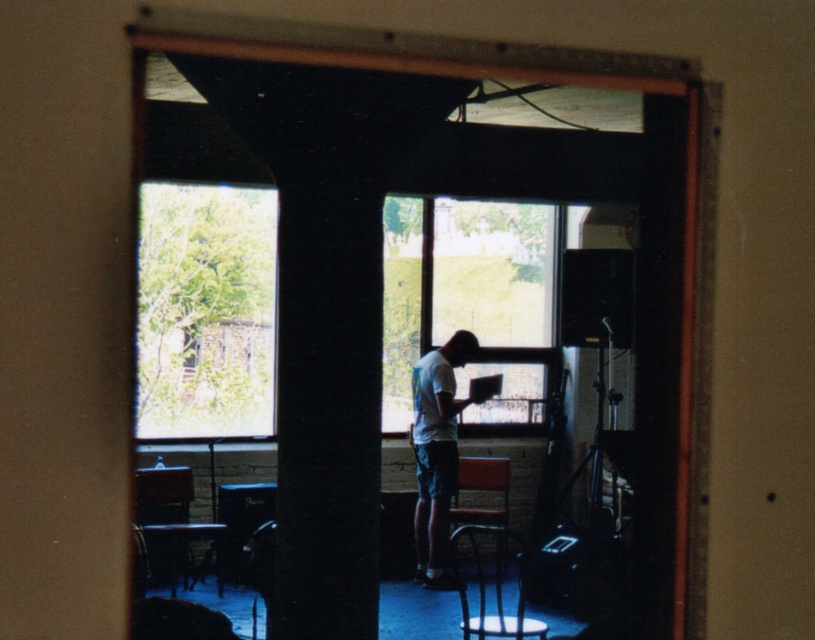
Is green leafy tree at upper left shorter than transparent glass window at center?

No.

Does green leafy tree at upper left have a greater height compared to transparent glass window at center?

Indeed, green leafy tree at upper left has a greater height compared to transparent glass window at center.

Which is behind, point (188, 429) or point (470, 204)?

The point (470, 204) is behind.

In order to click on green leafy tree at upper left in this screenshot , I will do `click(205, 310)`.

Does point (536, 632) come in front of point (463, 476)?

Yes.

Is wooden chair at lower center positioned before wooden chair at center?

Yes, wooden chair at lower center is closer to the viewer.

Is point (522, 637) closer to viewer compared to point (503, 474)?

Yes, it is in front of point (503, 474).

At what (x,y) coordinates should I click in order to perform the action: click on wooden chair at lower center. Please return your answer as a coordinate pair (x, y). This screenshot has height=640, width=815. Looking at the image, I should click on (492, 586).

Who is positioned more to the left, white cotton shirt at center or wooden chair at center?

From the viewer's perspective, white cotton shirt at center appears more on the left side.

Is white cotton shirt at center positioned in front of wooden chair at center?

Yes, white cotton shirt at center is in front of wooden chair at center.

Describe the element at coordinates (435, 449) in the screenshot. This screenshot has width=815, height=640. I see `white cotton shirt at center` at that location.

Where is `white cotton shirt at center`? The image size is (815, 640). white cotton shirt at center is located at coordinates (435, 449).